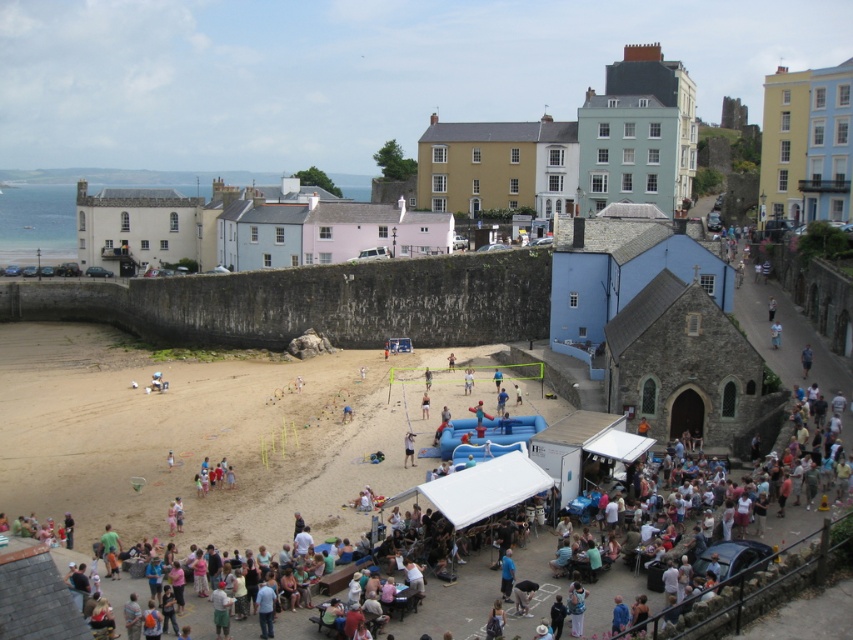
You are a drone operator trying to capture a photo of the beach. The drone is currently hovering above the light brown sand at center. To ensure the photo includes the colorful buildings in the background, should you adjust the drone to move north or south?

Since the light brown sand at center is located at point [199,436], moving the drone north would bring the stone wall and colorful buildings into view. Therefore, adjust the drone to move north to include the buildings in the photo.

You are standing at the edge of the beach and see the point marked at coordinates (199, 436). According to the scene description, what type of surface is this point located on?

The point marked at coordinates (199, 436) is located on light brown sand at center.